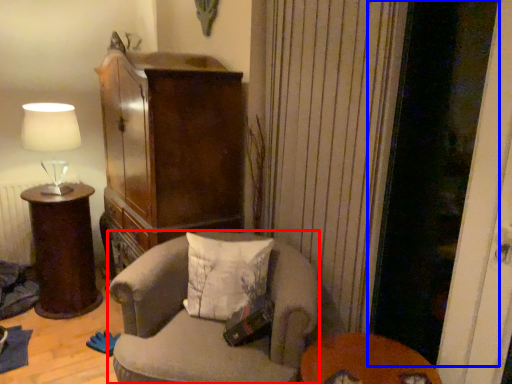
Question: Which point is closer to the camera, chair (highlighted by a red box) or screen door (highlighted by a blue box)?

Choices:
 (A) chair
 (B) screen door

Answer: (B)